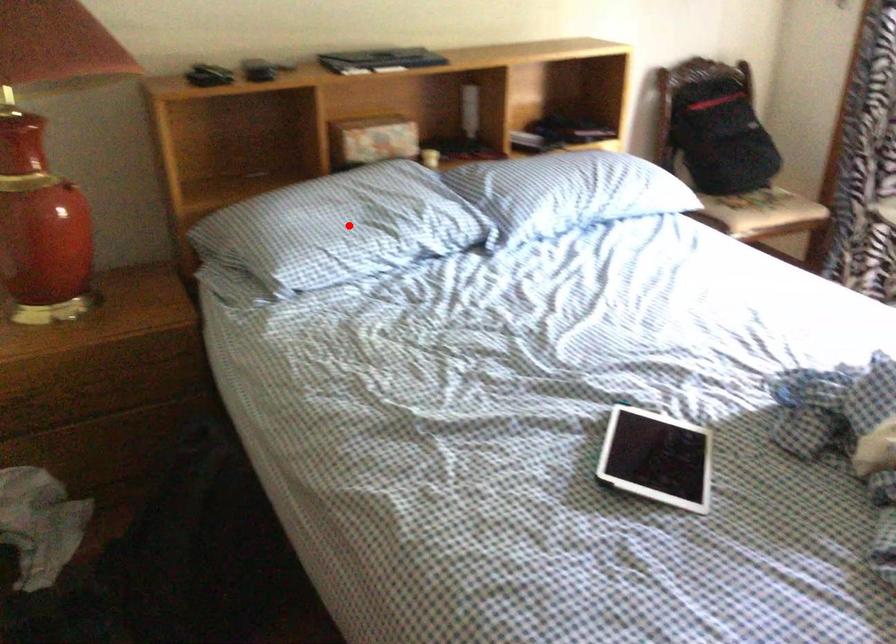
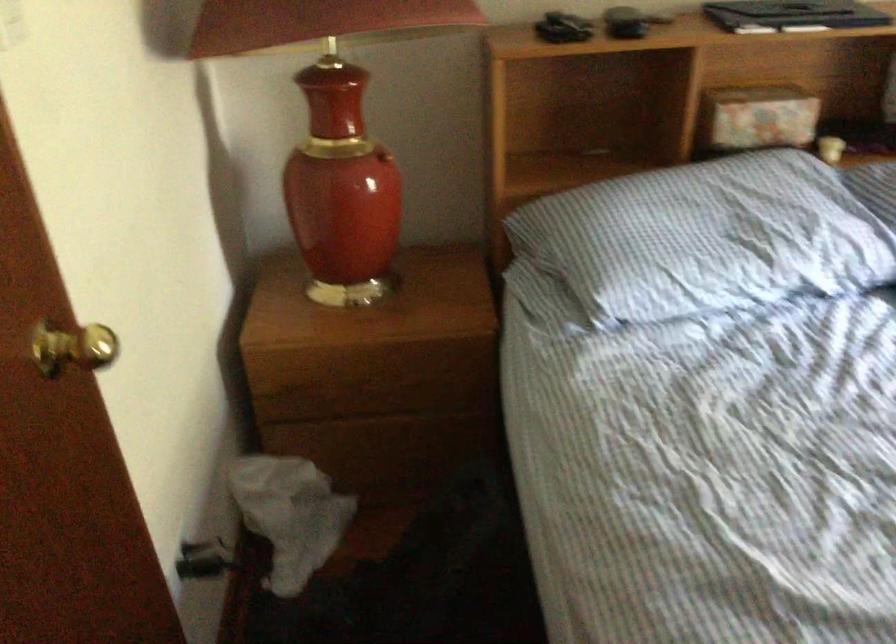
Find the pixel in the second image that matches the highlighted location in the first image.

(707, 238)